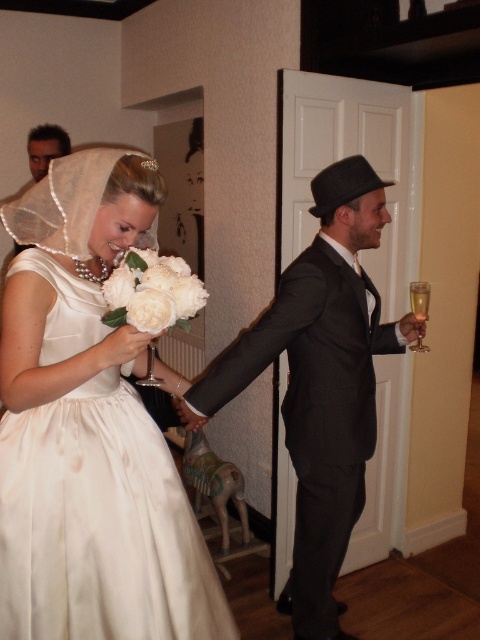
You are a photographer at the wedding reception. You need to capture a photo that includes both the satin dress at left and the white silk bouquet at center. Which object should you focus on first to ensure both are in frame?

The satin dress at left is closer to the viewer than the white silk bouquet at center, so focus on the satin dress at left first to ensure both are in frame.

You are standing at the center of the reception hall and want to take a photo of the bride and the man with the champagne. The bride is at point (80, 284) and the man is at point (322, 388). To ensure both are in the frame, should you move closer to the bride or the man with the champagne?

You should move closer to the bride at point (80, 284) because she is closer to you than the man at point (322, 388). Moving closer to her will help keep both subjects in the frame without excluding either.